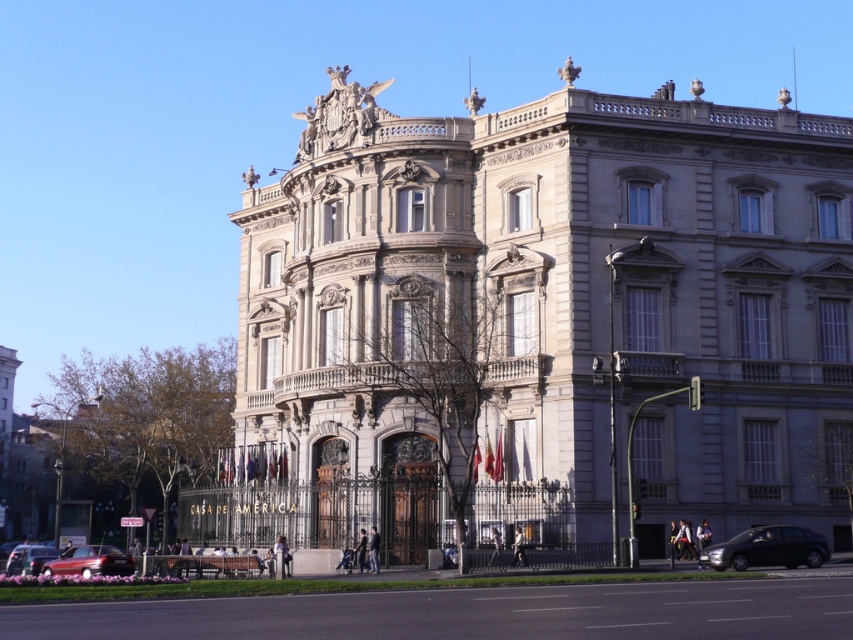
Who is lower down, gray stone palace at center or shiny black sedan at lower right?

shiny black sedan at lower right is below.

Between point (567, 218) and point (703, 561), which one is positioned behind?

The point (567, 218) is more distant.

The image size is (853, 640). I want to click on gray stone palace at center, so click(541, 324).

Who is positioned more to the left, shiny black sedan at lower right or metallic red car at lower left?

metallic red car at lower left is more to the left.

Does point (727, 564) lie behind point (103, 561)?

No.

Does point (746, 545) come in front of point (103, 570)?

Yes, it is.

The image size is (853, 640). I want to click on shiny black sedan at lower right, so click(767, 548).

Does point (831, 320) lie in front of point (10, 561)?

Yes.

From the picture: Can you confirm if gray stone palace at center is shorter than metallic silver car at lower left?

No, gray stone palace at center is not shorter than metallic silver car at lower left.

Which is behind, point (271, 324) or point (28, 566)?

Positioned behind is point (271, 324).

This screenshot has width=853, height=640. I want to click on gray stone palace at center, so click(541, 324).